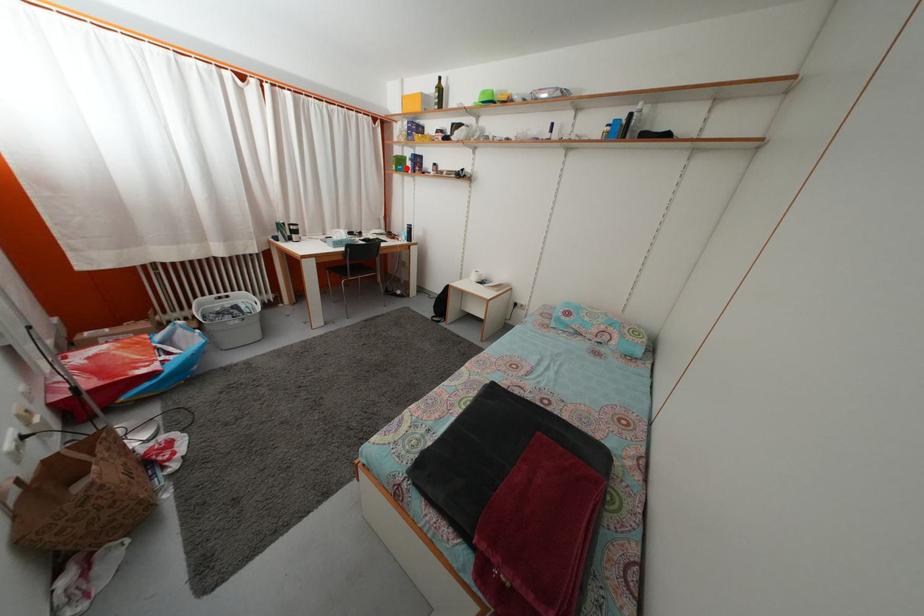
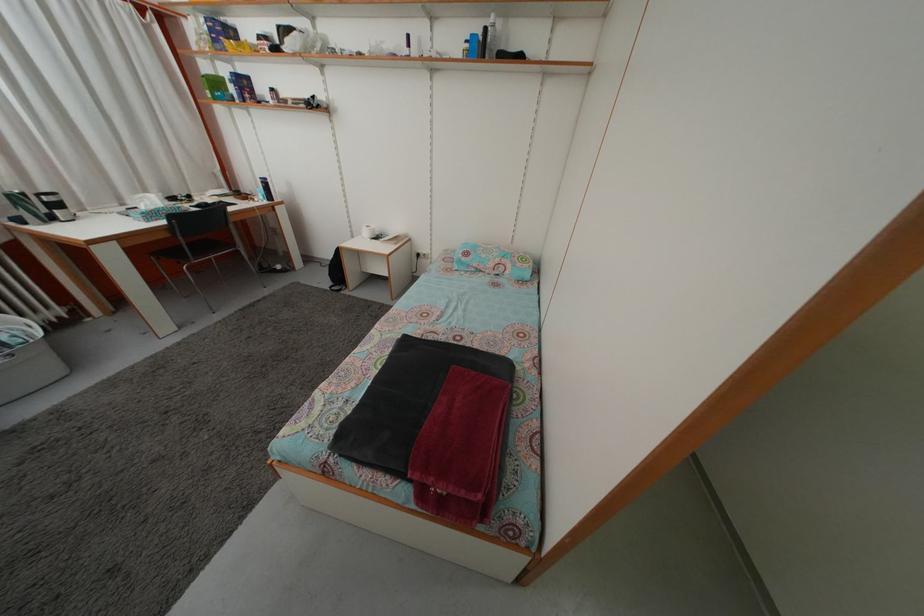
Locate, in the second image, the point that corresponds to the highlighted location in the first image.

(223, 91)